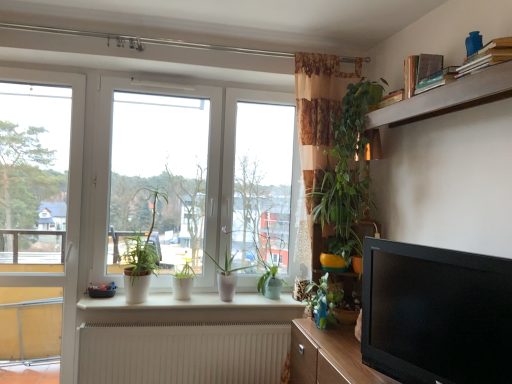
Question: Is white glossy window at center placed right next to green matte plant at center, placed as the first houseplant when sorted from left to right?

Choices:
 (A) no
 (B) yes

Answer: (A)

Question: Considering the relative positions of white glossy window at center and green matte plant at center, placed as the first houseplant when sorted from left to right, in the image provided, is white glossy window at center to the left of green matte plant at center, placed as the first houseplant when sorted from left to right, from the viewer's perspective?

Choices:
 (A) no
 (B) yes

Answer: (A)

Question: Would you say white glossy window at center is outside green matte plant at center, placed as the first houseplant when sorted from left to right?

Choices:
 (A) no
 (B) yes

Answer: (B)

Question: Is white glossy window at center aimed at green matte plant at center, placed as the first houseplant when sorted from left to right?

Choices:
 (A) yes
 (B) no

Answer: (A)

Question: Is green matte plant at center, marked as the 5th houseplant in a right-to-left arrangement, inside white glossy window at center?

Choices:
 (A) yes
 (B) no

Answer: (A)

Question: Is green leafy plant at upper center, which is counted as the 5th houseplant, starting from the left, spatially inside beige textured radiator at lower center, or outside of it?

Choices:
 (A) inside
 (B) outside

Answer: (B)

Question: Is green leafy plant at upper center, the 1th houseplant in the right-to-left sequence, wider or thinner than beige textured radiator at lower center?

Choices:
 (A) wide
 (B) thin

Answer: (A)

Question: From a real-world perspective, is green leafy plant at upper center, which is counted as the 5th houseplant, starting from the left, positioned above or below beige textured radiator at lower center?

Choices:
 (A) above
 (B) below

Answer: (A)

Question: Considering the positions of green leafy plant at upper center, which is counted as the 5th houseplant, starting from the left, and beige textured radiator at lower center in the image, is green leafy plant at upper center, which is counted as the 5th houseplant, starting from the left, bigger or smaller than beige textured radiator at lower center?

Choices:
 (A) small
 (B) big

Answer: (A)

Question: Does point (309, 129) appear closer or farther from the camera than point (156, 168)?

Choices:
 (A) closer
 (B) farther

Answer: (A)

Question: From the image's perspective, relative to white glossy window at center, is green leafy plant at upper center, which is counted as the 5th houseplant, starting from the left, above or below?

Choices:
 (A) above
 (B) below

Answer: (A)

Question: Is green leafy plant at upper center, the 1th houseplant in the right-to-left sequence, taller or shorter than white glossy window at center?

Choices:
 (A) short
 (B) tall

Answer: (A)

Question: Is green leafy plant at upper center, which is counted as the 5th houseplant, starting from the left, wider or thinner than white glossy window at center?

Choices:
 (A) wide
 (B) thin

Answer: (A)

Question: Looking at their shapes, would you say wooden textured shelf at right, which appears as the 2th shelf when viewed from the front, is wider or thinner than white matte pot at window, placed as the 3th houseplant when sorted from left to right?

Choices:
 (A) wide
 (B) thin

Answer: (A)

Question: From the image's perspective, is wooden textured shelf at right, placed as the first shelf when sorted from bottom to top, located above or below white matte pot at window, placed as the 3th houseplant when sorted from left to right?

Choices:
 (A) below
 (B) above

Answer: (B)